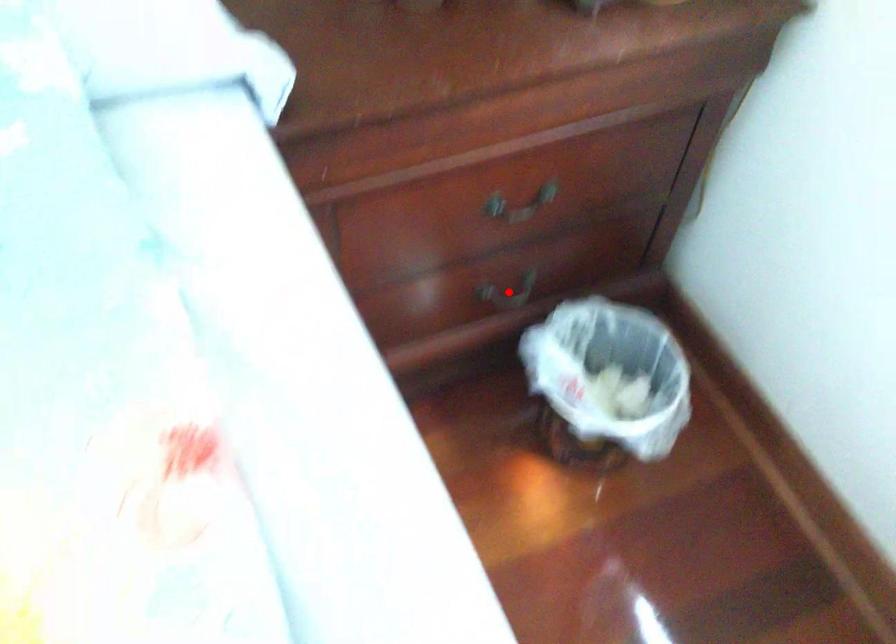
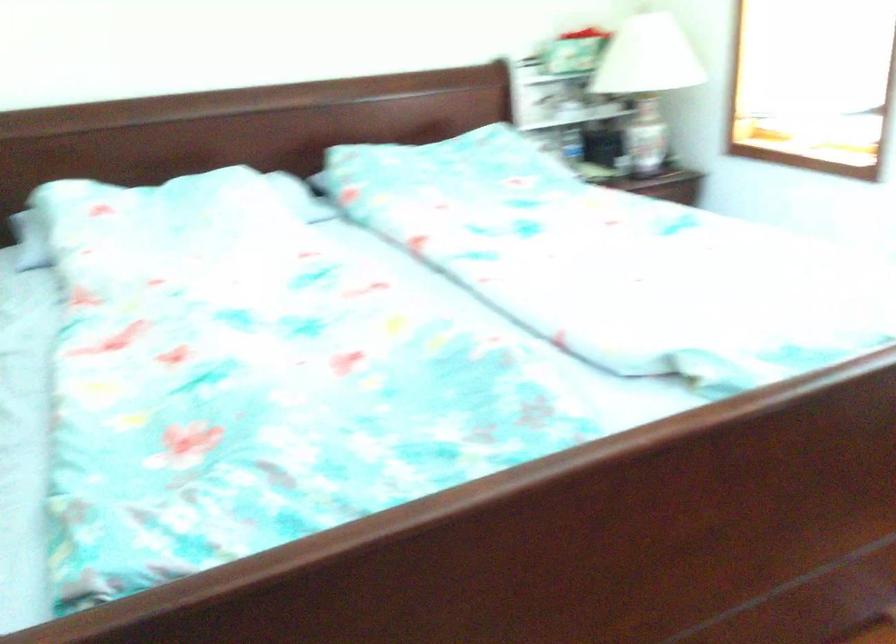
Question: I am providing you with two images of the same scene from different viewpoints. A red point is marked on the first image. Can you still see the location of the red point in image 2?

Choices:
 (A) Yes
 (B) No

Answer: (B)